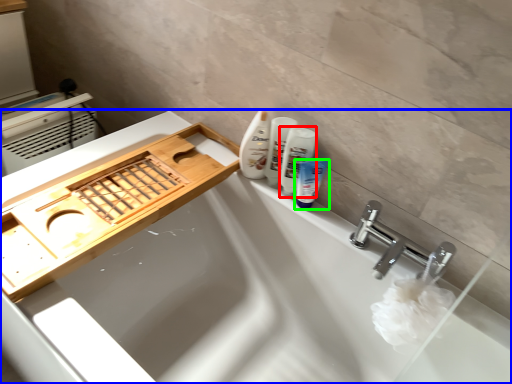
Question: Which is nearer to the mouthwash (highlighted by a red box)? bathtub (highlighted by a blue box) or toiletry (highlighted by a green box).

Choices:
 (A) bathtub
 (B) toiletry

Answer: (B)